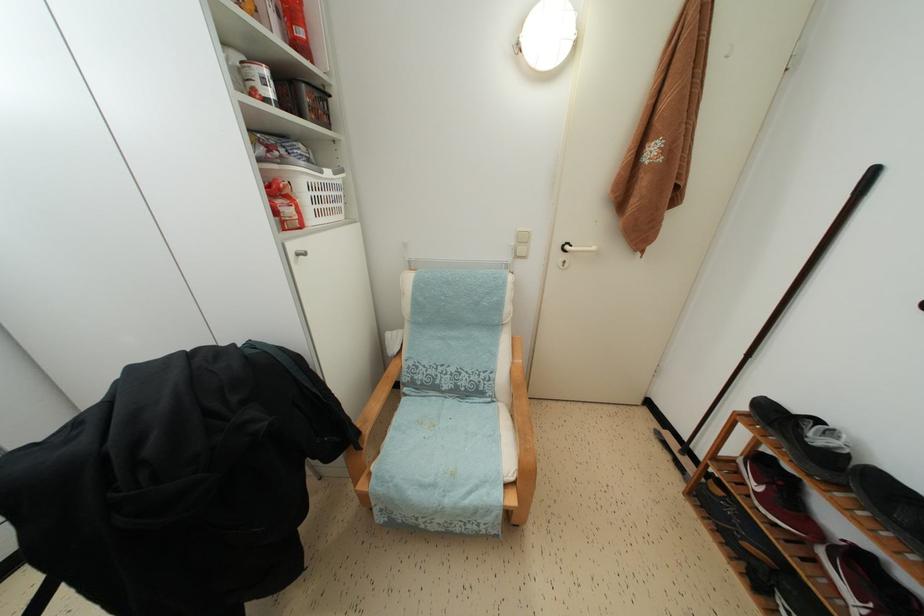
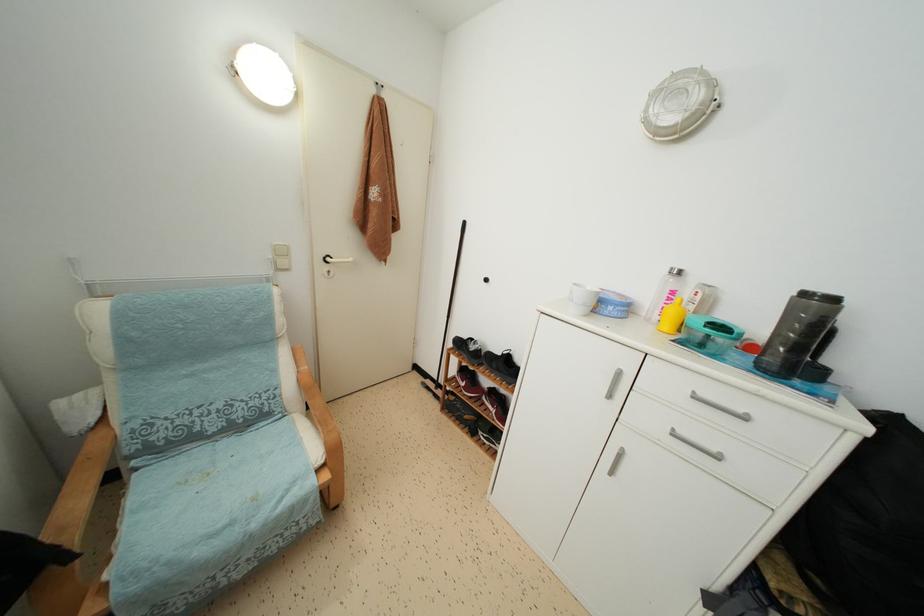
In the second image, find the point that corresponds to [736,466] in the first image.

(457, 383)